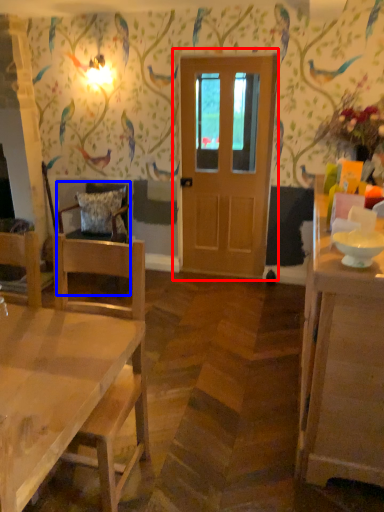
Question: Which of the following is the farthest to the observer, door (highlighted by a red box) or chair (highlighted by a blue box)?

Choices:
 (A) door
 (B) chair

Answer: (B)